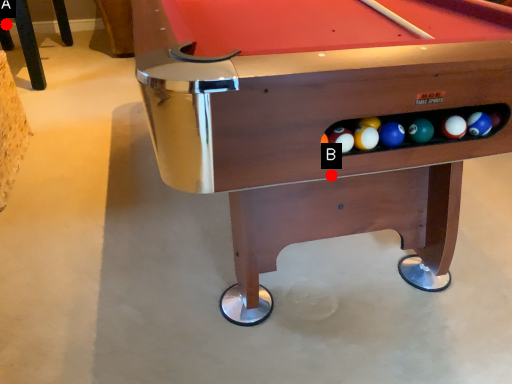
Question: Two points are circled on the image, labeled by A and B beside each circle. Among these points, which one is farthest from the camera?

Choices:
 (A) A is further
 (B) B is further

Answer: (A)